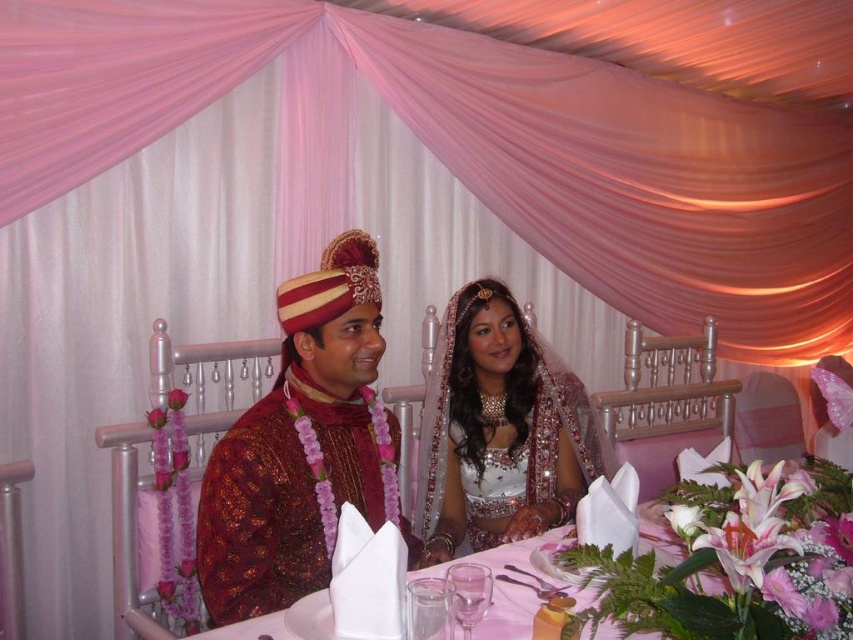
Question: From the image, what is the correct spatial relationship of shiny silk turban at center in relation to satin white blouse at center?

Choices:
 (A) below
 (B) above

Answer: (A)

Question: Is shiny silk turban at center smaller than satin white blouse at center?

Choices:
 (A) yes
 (B) no

Answer: (B)

Question: Among these objects, which one is farthest from the camera?

Choices:
 (A) shiny silk turban at center
 (B) satin white blouse at center

Answer: (B)

Question: Which point is closer to the camera?

Choices:
 (A) satin white blouse at center
 (B) shiny silk turban at center

Answer: (B)

Question: Is shiny silk turban at center bigger than satin white blouse at center?

Choices:
 (A) no
 (B) yes

Answer: (B)